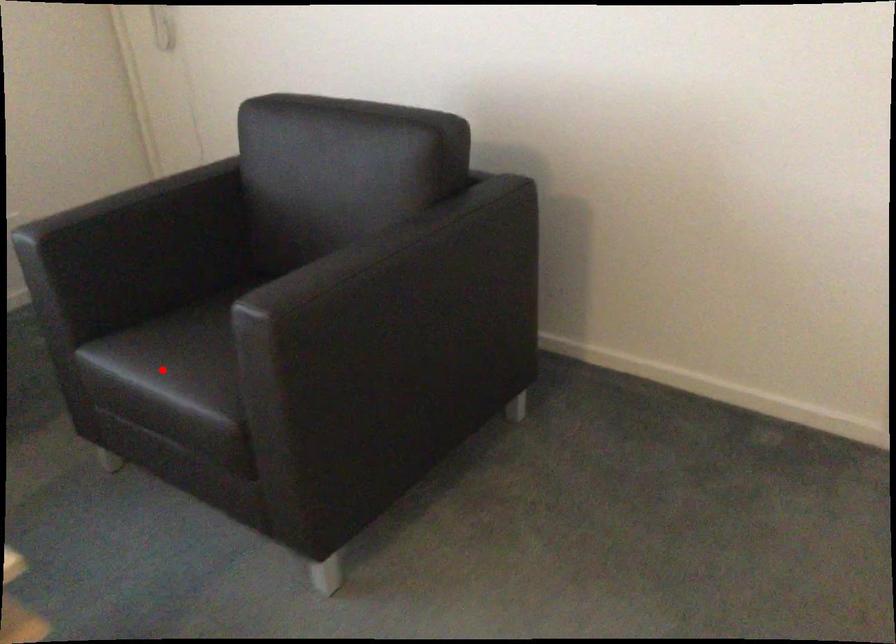
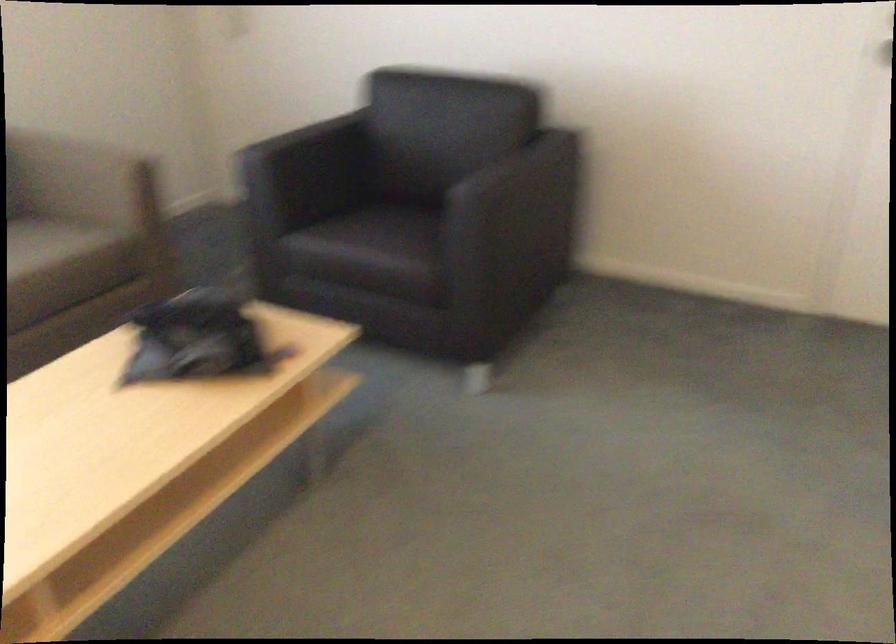
Question: I am providing you with two images of the same scene from different viewpoints. In image1, a red point is highlighted. Considering the same 3D point in image2, which of the following is correct?

Choices:
 (A) It is closer
 (B) It is farther

Answer: (B)